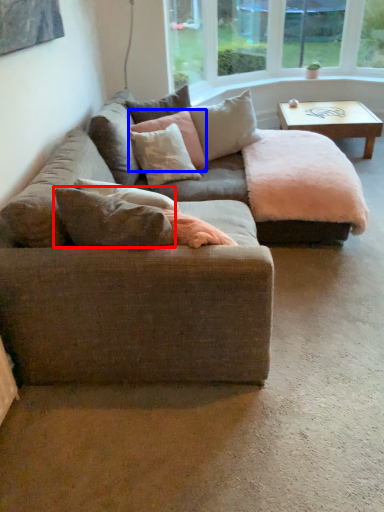
Question: Which of the following is the farthest to the observer, pillow (highlighted by a red box) or pillow (highlighted by a blue box)?

Choices:
 (A) pillow
 (B) pillow

Answer: (B)